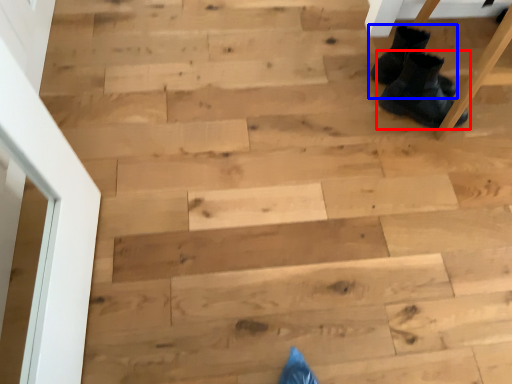
Question: Which point is closer to the camera, footwear (highlighted by a red box) or footwear (highlighted by a blue box)?

Choices:
 (A) footwear
 (B) footwear

Answer: (A)